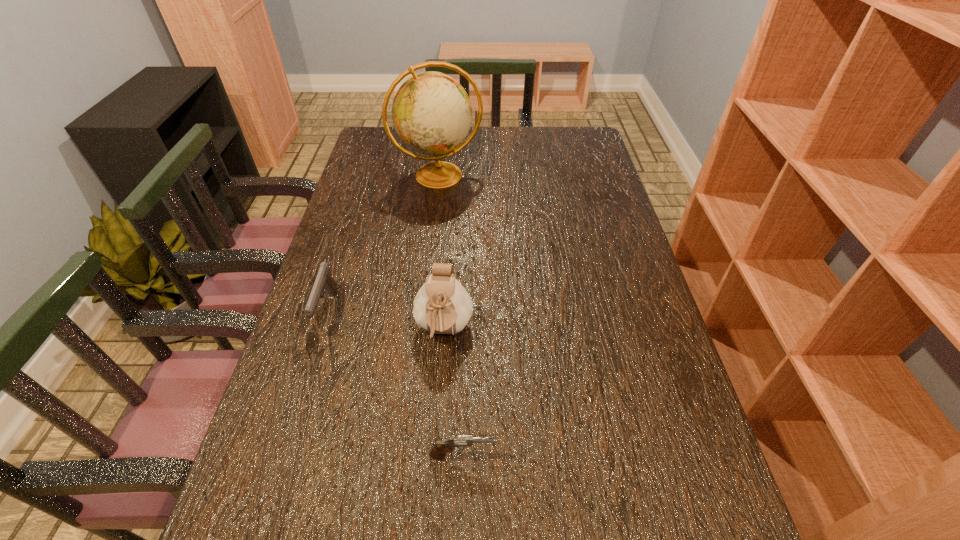
Find the location of a particular element. vacant space located 0.150m at the barrel of the shorter pistol is located at coordinates (572, 455).

This screenshot has height=540, width=960. What are the coordinates of `object present at the far edge` in the screenshot? It's located at (432, 114).

Locate an element on the screen. The width and height of the screenshot is (960, 540). globe that is at the left edge is located at coordinates (432, 114).

Identify the location of pistol at the left edge. This screenshot has height=540, width=960. (324, 282).

Image resolution: width=960 pixels, height=540 pixels. I want to click on object that is at the far left corner, so click(x=432, y=114).

This screenshot has height=540, width=960. Find the location of `vacant region at the far edge of the desktop`. vacant region at the far edge of the desktop is located at coordinates pos(550,148).

Locate an element on the screen. vacant space at the left edge of the desktop is located at coordinates pos(385,212).

The width and height of the screenshot is (960, 540). In the image, there is a desktop. Identify the location of free region at the right edge. tap(683, 440).

Where is `free space at the far right corner`? Image resolution: width=960 pixels, height=540 pixels. free space at the far right corner is located at coordinates (572, 158).

Image resolution: width=960 pixels, height=540 pixels. In order to click on free space between the pouch and the farthest object in this screenshot , I will do `click(442, 253)`.